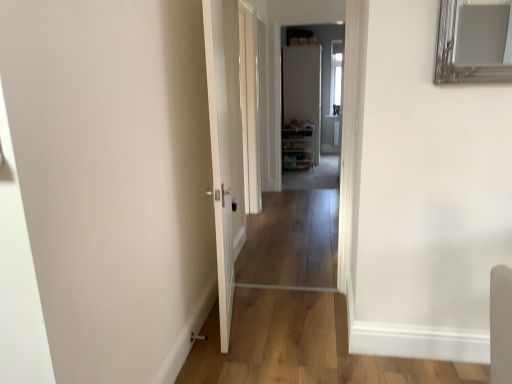
Question: In which direction should I rotate to look at white glossy door at upper center, marked as the 2th door in a left-to-right arrangement?

Choices:
 (A) right
 (B) left

Answer: (A)

Question: Is clear glass door at center at the right side of white glossy door at upper center, which is the 2th door in front-to-back order?

Choices:
 (A) yes
 (B) no

Answer: (B)

Question: Does clear glass door at center come behind white glossy door at upper center, the 1th door when ordered from back to front?

Choices:
 (A) yes
 (B) no

Answer: (B)

Question: Considering the relative sizes of clear glass door at center and white glossy door at upper center, which is the 2th door in front-to-back order, in the image provided, is clear glass door at center bigger than white glossy door at upper center, which is the 2th door in front-to-back order,?

Choices:
 (A) yes
 (B) no

Answer: (A)

Question: Does clear glass door at center come in front of white glossy door at upper center, the 1th door when ordered from back to front?

Choices:
 (A) yes
 (B) no

Answer: (A)

Question: Considering the relative sizes of clear glass door at center and white glossy door at upper center, marked as the 2th door in a left-to-right arrangement, in the image provided, is clear glass door at center thinner than white glossy door at upper center, marked as the 2th door in a left-to-right arrangement,?

Choices:
 (A) no
 (B) yes

Answer: (B)

Question: From the image's perspective, does clear glass door at center appear higher than white glossy door at upper center, marked as the 2th door in a left-to-right arrangement?

Choices:
 (A) yes
 (B) no

Answer: (B)

Question: From a real-world perspective, is white glossy door at center, acting as the first door starting from the left, under clear glass door at center?

Choices:
 (A) yes
 (B) no

Answer: (A)

Question: Is white glossy door at center, the second door from the back, oriented away from clear glass door at center?

Choices:
 (A) no
 (B) yes

Answer: (A)

Question: Considering the relative positions of white glossy door at center, which appears as the second door when viewed from the right, and clear glass door at center in the image provided, is white glossy door at center, which appears as the second door when viewed from the right, behind clear glass door at center?

Choices:
 (A) no
 (B) yes

Answer: (A)

Question: Is white glossy door at center, acting as the first door starting from the left, positioned before clear glass door at center?

Choices:
 (A) yes
 (B) no

Answer: (A)

Question: Does white glossy door at center, which appears as the second door when viewed from the right, have a smaller size compared to clear glass door at center?

Choices:
 (A) no
 (B) yes

Answer: (A)

Question: From a real-world perspective, is white glossy door at center, the first door viewed from the front, physically above clear glass door at center?

Choices:
 (A) yes
 (B) no

Answer: (B)

Question: Is white glossy door at center, the second door from the back, at the back of white glossy door at upper center, which is the 2th door in front-to-back order?

Choices:
 (A) no
 (B) yes

Answer: (A)